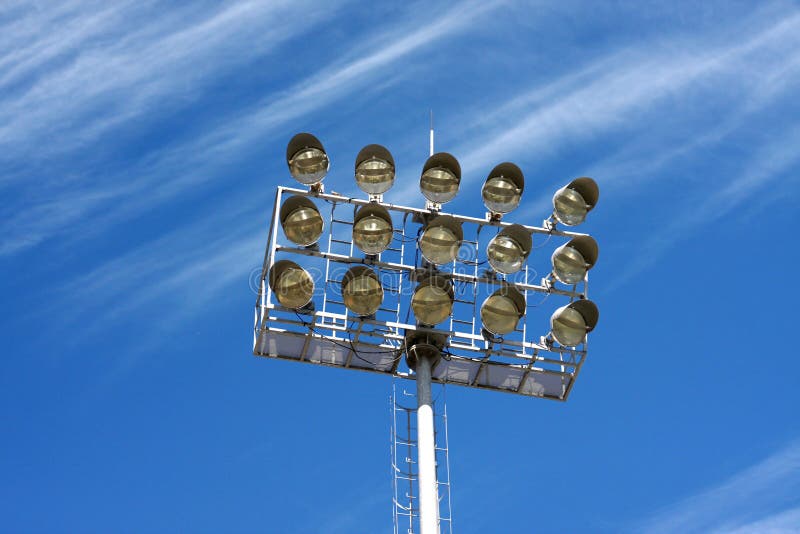
This screenshot has width=800, height=534. What are the coordinates of `the bottom row of lights` in the screenshot? It's located at (288, 286), (353, 284), (425, 296), (501, 307), (570, 324).